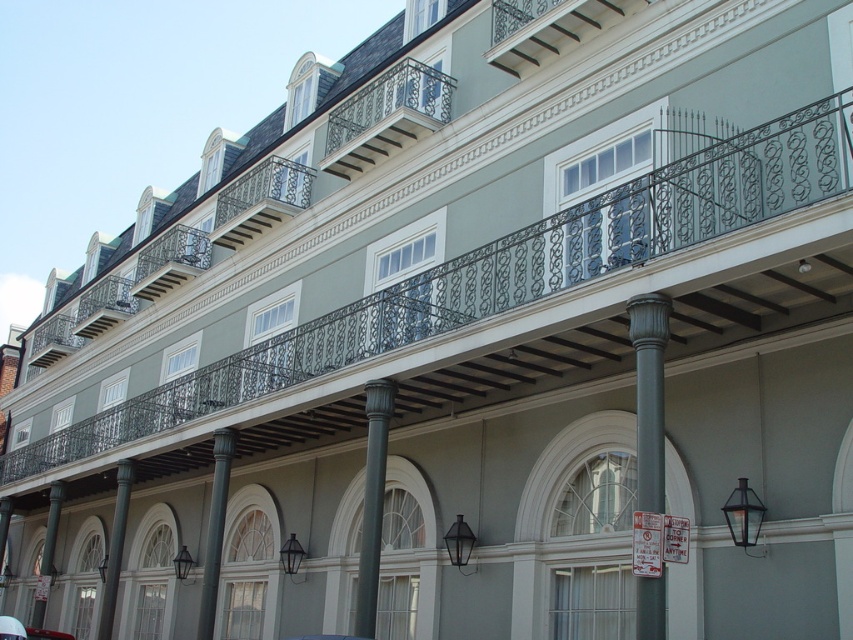
Who is lower down, green painted metal pole at center-right or black wrought iron balcony at center?

green painted metal pole at center-right is below.

Is point (651, 632) positioned behind point (236, 243)?

That is False.

Based on the photo, who is more forward, (636, 378) or (254, 220)?

Point (636, 378)

Where is `green painted metal pole at center-right`? green painted metal pole at center-right is located at coordinates point(648,394).

Where is `green painted metal pole at center-right`? This screenshot has width=853, height=640. green painted metal pole at center-right is located at coordinates (648, 394).

Who is more forward, (646, 340) or (51, 493)?

Point (646, 340) is in front.

What do you see at coordinates (648, 394) in the screenshot? I see `green painted metal pole at center-right` at bounding box center [648, 394].

This screenshot has height=640, width=853. Identify the location of green painted metal pole at center-right. (648, 394).

Is smooth gray column at lower left below shiny red car at lower left?

No, smooth gray column at lower left is not below shiny red car at lower left.

Is smooth gray column at lower left shorter than shiny red car at lower left?

Incorrect, smooth gray column at lower left's height does not fall short of shiny red car at lower left's.

Who is more distant from viewer, (123, 464) or (0, 625)?

Positioned behind is point (123, 464).

Locate an element on the screen. The width and height of the screenshot is (853, 640). smooth gray column at lower left is located at coordinates (115, 547).